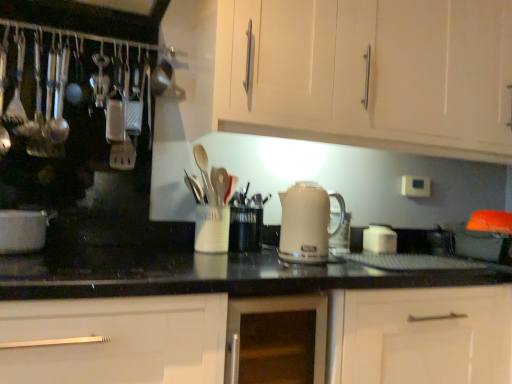
Question: From a real-world perspective, is white plastic electric outlet at upper right physically located above or below white glossy pot at left?

Choices:
 (A) above
 (B) below

Answer: (A)

Question: Is point (411, 185) closer or farther from the camera than point (45, 215)?

Choices:
 (A) farther
 (B) closer

Answer: (A)

Question: Considering the real-world distances, which object is farthest from the white matte cabinet at upper center, arranged as the 2th cabinetry when ordered from the bottom?

Choices:
 (A) white glossy cabinet at center, the 1th cabinetry positioned from the bottom
 (B) white plastic electric outlet at upper right
 (C) white matte cup at center
 (D) black glass gas stove at lower left
 (E) beige glossy kettle at center

Answer: (D)

Question: Which object is the closest to the black glass gas stove at lower left?

Choices:
 (A) white matte cup at center
 (B) white plastic electric outlet at upper right
 (C) white glossy pot at left
 (D) white matte cabinet at upper center, arranged as the 2th cabinetry when ordered from the bottom
 (E) white glossy cabinet at center, which appears as the second cabinetry when viewed from the top

Answer: (C)